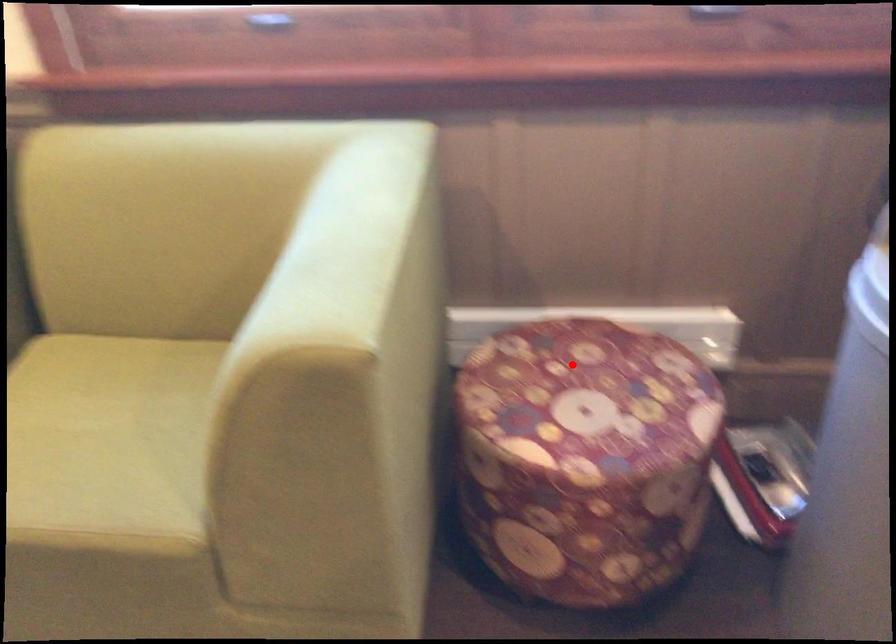
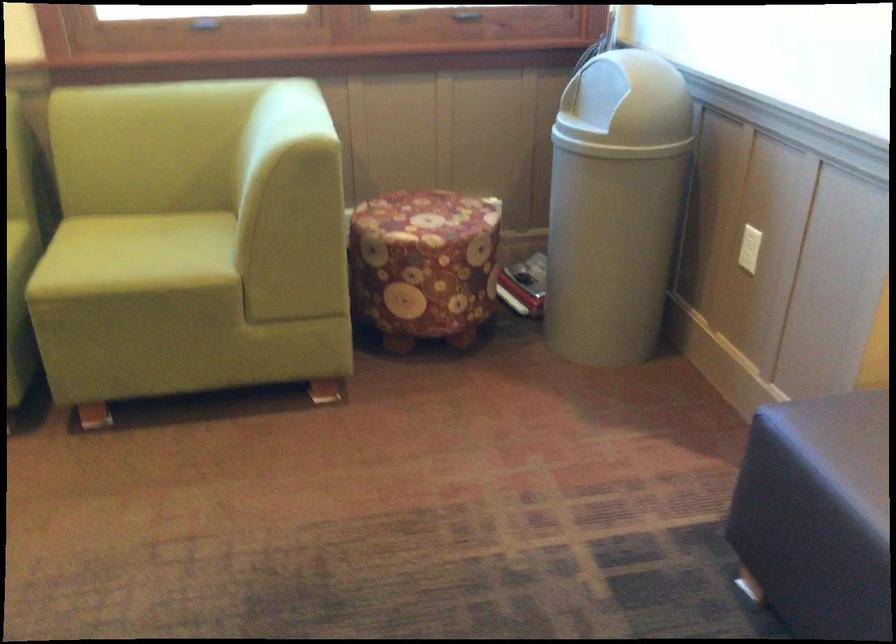
Find the pixel in the second image that matches the highlighted location in the first image.

(414, 207)